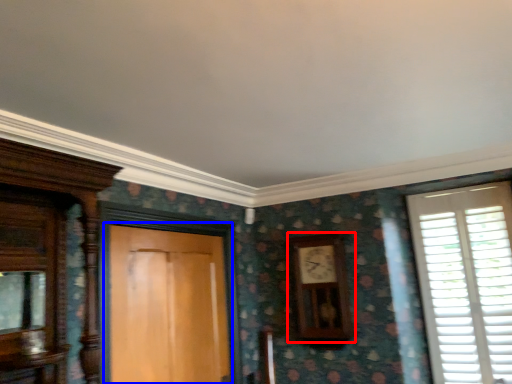
Question: Which point is further to the camera, clock (highlighted by a red box) or door (highlighted by a blue box)?

Choices:
 (A) clock
 (B) door

Answer: (A)